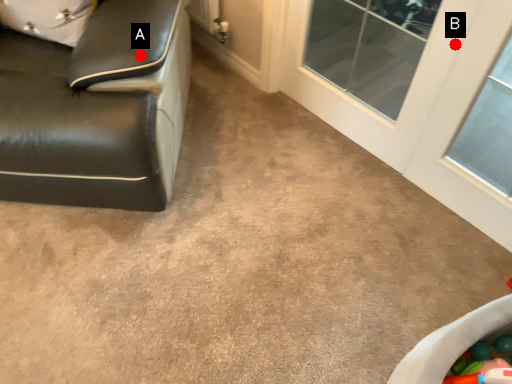
Question: Two points are circled on the image, labeled by A and B beside each circle. Which of the following is the closest to the observer?

Choices:
 (A) A is closer
 (B) B is closer

Answer: (A)